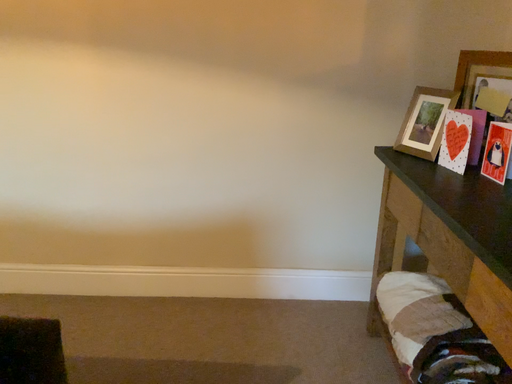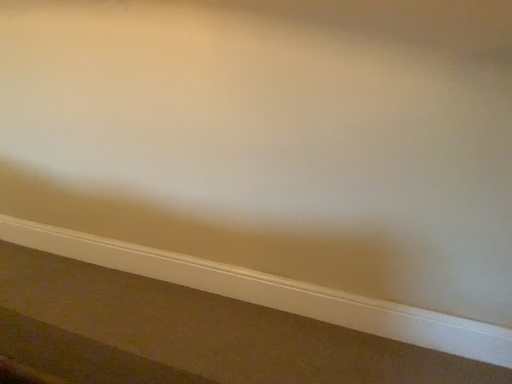
Question: Which way did the camera rotate in the video?

Choices:
 (A) rotated left
 (B) rotated right

Answer: (A)